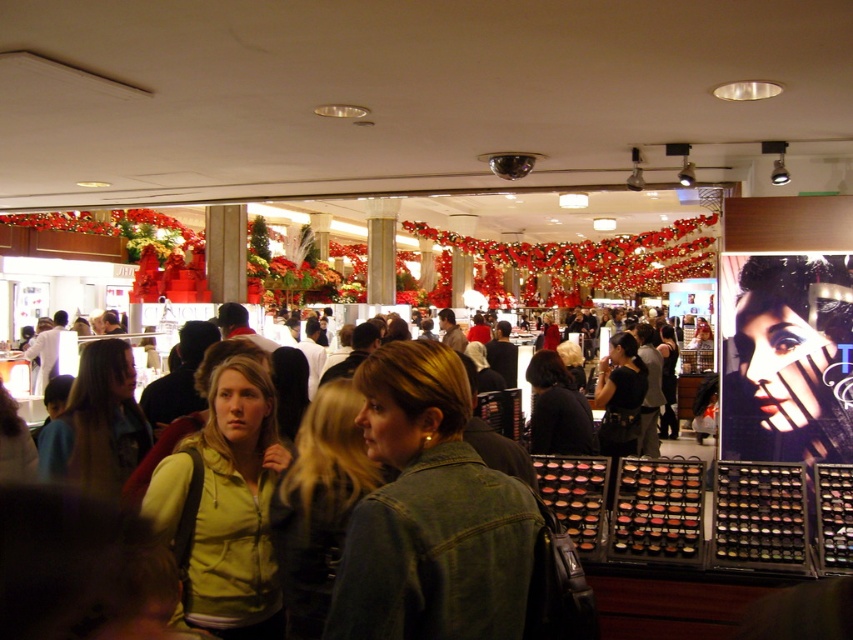
You are a delivery person who just arrived with a package for the store. You need to place the package between the denim jacket at center and the matte yellow hoodie at center. Is there enough space to fit the package, which is 1.2 meters long?

The distance between the denim jacket at center and the matte yellow hoodie at center is 1.08 meters, so the package that is 1.2 meters long cannot fit between them as the space is shorter than the package length.

You are a store employee who needs to restock a shelf between the denim jacket at center and the matte yellow hoodie at center. Which side of the shelf should you approach from to place items between them?

You should approach from the left side of the shelf because the denim jacket at center is to the right of the matte yellow hoodie at center, so placing items between them would require starting from the left side of the shelf.